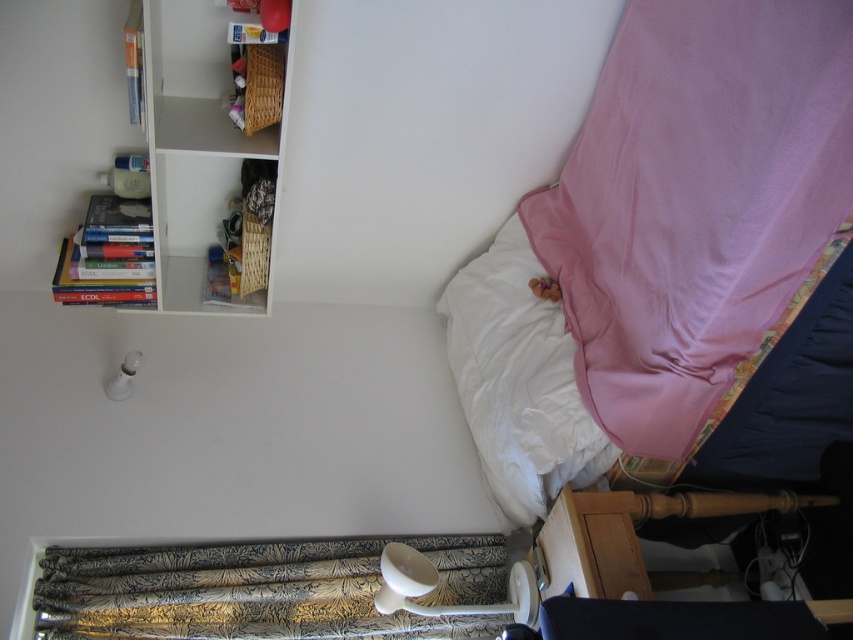
Question: Which object is positioned farthest from the pink fabric curtain at right?

Choices:
 (A) white matte bookshelf at upper left
 (B) gold-patterned fabric curtain at lower left
 (C) wooden basket at upper left

Answer: (C)

Question: Which of the following is the closest to the observer?

Choices:
 (A) (x=682, y=26)
 (B) (x=160, y=244)
 (C) (x=550, y=387)
 (D) (x=161, y=285)

Answer: (A)

Question: Is white soft pillow at upper right below wooden basket at upper left?

Choices:
 (A) yes
 (B) no

Answer: (A)

Question: Which point is farther to the camera?

Choices:
 (A) pink fabric curtain at right
 (B) gold-patterned fabric curtain at lower left
 (C) white soft pillow at upper right

Answer: (C)

Question: Can you confirm if pink fabric curtain at right is smaller than wooden basket at upper left?

Choices:
 (A) yes
 (B) no

Answer: (B)

Question: Can you confirm if white matte bookshelf at upper left is smaller than white soft pillow at upper right?

Choices:
 (A) no
 (B) yes

Answer: (A)